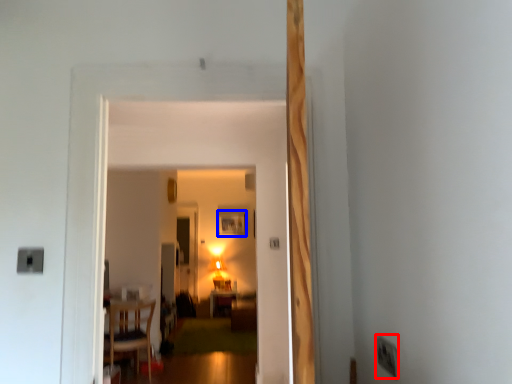
Question: Which of the following is the closest to the observer, electric outlet (highlighted by a red box) or picture frame (highlighted by a blue box)?

Choices:
 (A) electric outlet
 (B) picture frame

Answer: (A)